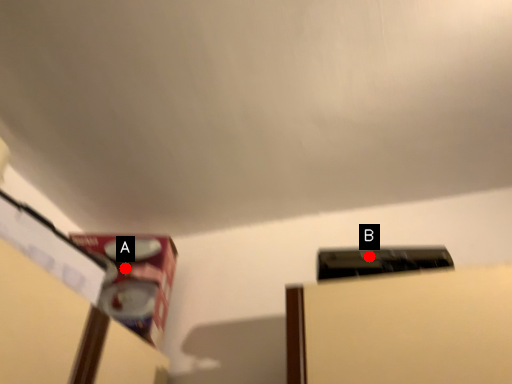
Question: Two points are circled on the image, labeled by A and B beside each circle. Which of the following is the farthest from the observer?

Choices:
 (A) A is further
 (B) B is further

Answer: (A)